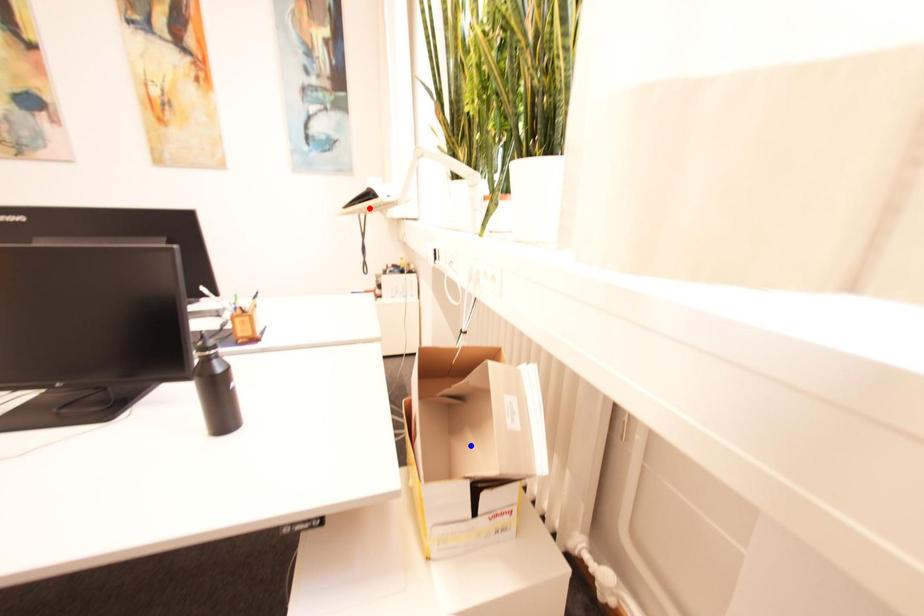
Question: Two points are marked on the image. Which point is closer to the camera?

Choices:
 (A) Blue point is closer.
 (B) Red point is closer.

Answer: (A)